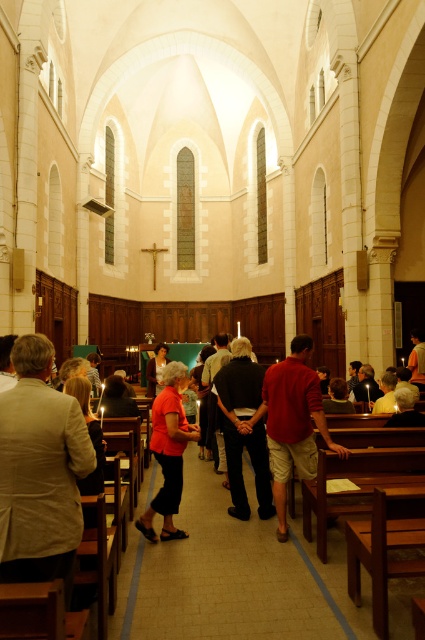
Question: Does red cotton shirt at center have a larger size compared to matte red blouse at center?

Choices:
 (A) yes
 (B) no

Answer: (A)

Question: Among these points, which one is farthest from the camera?

Choices:
 (A) (309, 470)
 (B) (178, 419)
 (C) (244, 387)
 (D) (48, 554)

Answer: (C)

Question: Estimate the real-world distances between objects in this image. Which object is closer to the dark brown leather jacket at center?

Choices:
 (A) red cotton shirt at center
 (B) matte red blouse at center
 (C) light brown linen jacket at left

Answer: (A)

Question: Which of the following is the closest to the observer?

Choices:
 (A) (229, 470)
 (B) (161, 502)
 (C) (45, 449)
 (D) (308, 388)

Answer: (C)

Question: Does red cotton shirt at center come in front of dark brown leather jacket at center?

Choices:
 (A) yes
 (B) no

Answer: (A)

Question: Does red cotton shirt at center appear over dark brown leather jacket at center?

Choices:
 (A) yes
 (B) no

Answer: (A)